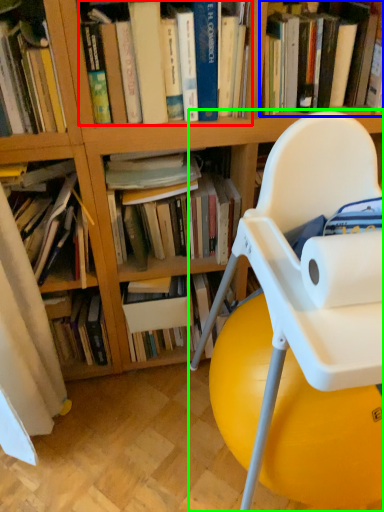
Question: Which is nearer to the book (highlighted by a red box)? book (highlighted by a blue box) or chair (highlighted by a green box).

Choices:
 (A) book
 (B) chair

Answer: (A)